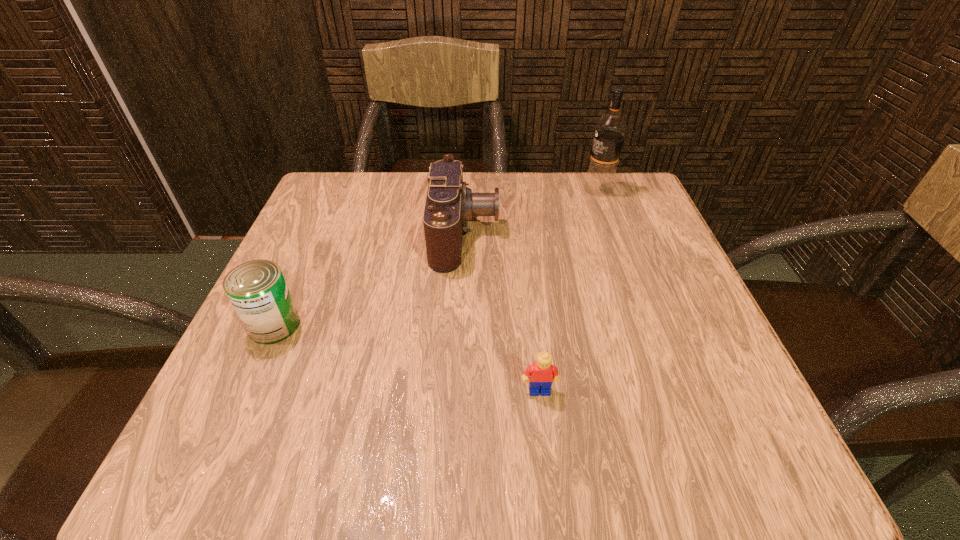
Where is `vacant space in between the Lego and the third object from right to left`? The image size is (960, 540). vacant space in between the Lego and the third object from right to left is located at coordinates (502, 312).

Image resolution: width=960 pixels, height=540 pixels. What are the coordinates of `free point between the second farthest object and the leftmost object` in the screenshot? It's located at (370, 280).

Find the location of a particular element. The image size is (960, 540). free space between the second object from left to right and the nearest object is located at coordinates (502, 312).

Locate an element on the screen. the second closest object to the vodka is located at coordinates (542, 374).

This screenshot has height=540, width=960. What are the coordinates of `object that stands as the second closest to the vodka` in the screenshot? It's located at (542, 374).

Find the location of a particular element. vacant space that satisfies the following two spatial constraints: 1. on the label of the vodka; 2. on the face of the nearest object is located at coordinates coord(672,390).